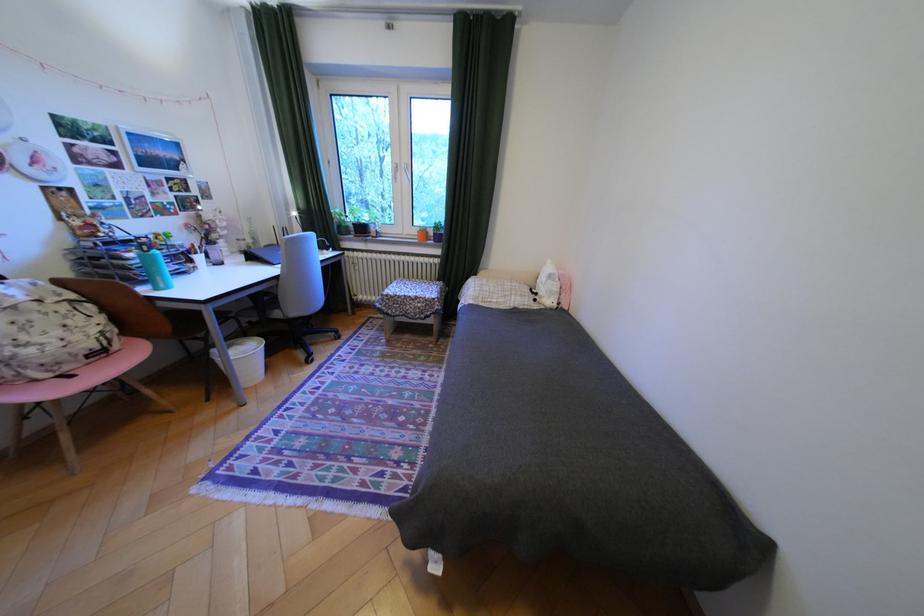
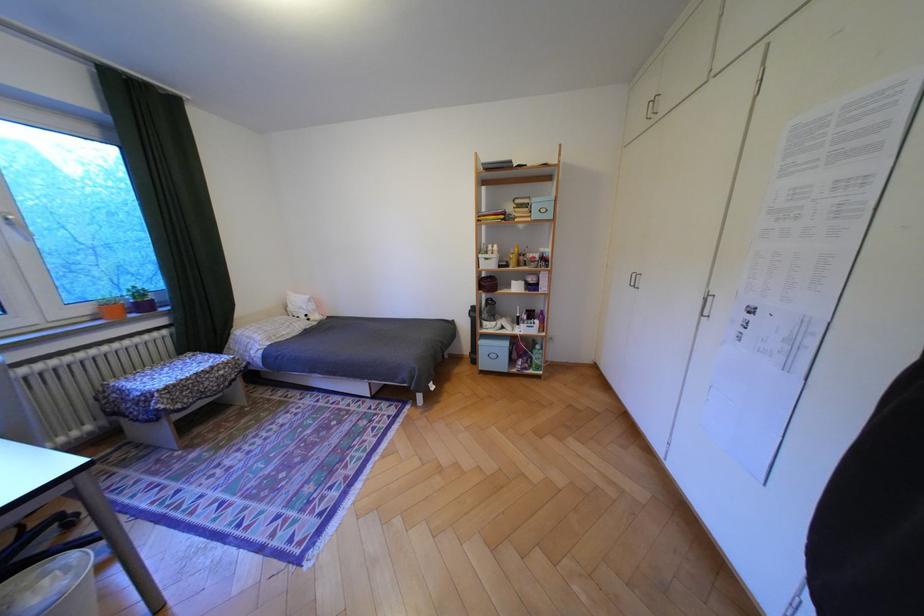
Question: I am providing you with two images of the same scene from different viewpoints. Which of the following objects are not visible in image2?

Choices:
 (A) white cabinet handle
 (B) light blue box
 (C) white window handle
 (D) none of these

Answer: (D)